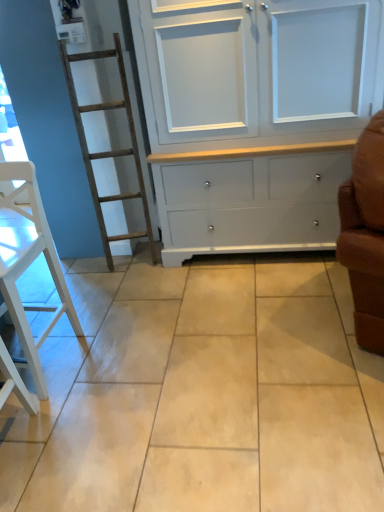
Describe the element at coordinates (201, 394) in the screenshot. I see `beige ceramic tile at center` at that location.

This screenshot has height=512, width=384. What do you see at coordinates (254, 116) in the screenshot?
I see `white painted wood cupboard at center` at bounding box center [254, 116].

Where is `beige ceramic tile at center`? Image resolution: width=384 pixels, height=512 pixels. beige ceramic tile at center is located at coordinates (201, 394).

Measure the distance from beige ceramic tile at center to white painted wood cupboard at center.

They are 31.58 inches apart.

Is beige ceramic tile at center outside of white painted wood cupboard at center?

Yes.

Is beige ceramic tile at center oriented away from white painted wood cupboard at center?

That's not correct — beige ceramic tile at center is not looking away from white painted wood cupboard at center.

Based on their sizes in the image, would you say beige ceramic tile at center is bigger or smaller than white painted wood cupboard at center?

beige ceramic tile at center is smaller than white painted wood cupboard at center.

From a real-world perspective, is beige ceramic tile at center beneath white wood chair at left?

Yes, from a real-world perspective, beige ceramic tile at center is beneath white wood chair at left.

Looking at their sizes, would you say beige ceramic tile at center is wider or thinner than white wood chair at left?

Considering their sizes, beige ceramic tile at center looks broader than white wood chair at left.

Is beige ceramic tile at center shorter than white wood chair at left?

Yes, beige ceramic tile at center is shorter than white wood chair at left.

Is point (255, 232) farther from camera compared to point (24, 501)?

Yes, it is.

Considering the relative positions of white painted wood cupboard at center and beige ceramic tile at center in the image provided, is white painted wood cupboard at center to the left of beige ceramic tile at center from the viewer's perspective?

No, white painted wood cupboard at center is not to the left of beige ceramic tile at center.

From the picture: Is white painted wood cupboard at center completely or partially outside of beige ceramic tile at center?

white painted wood cupboard at center lies outside beige ceramic tile at center's area.

Considering the sizes of objects white wood chair at left and white painted wood cupboard at center in the image provided, who is bigger, white wood chair at left or white painted wood cupboard at center?

white painted wood cupboard at center.

Which is in front, point (5, 292) or point (285, 55)?

The point (5, 292) is in front.

From their relative heights in the image, would you say white wood chair at left is taller or shorter than white painted wood cupboard at center?

white wood chair at left is shorter than white painted wood cupboard at center.

From a real-world perspective, between white wood chair at left and white painted wood cupboard at center, who is vertically lower?

white wood chair at left.

Which is in front, point (169, 117) or point (3, 281)?

The point (3, 281) is more forward.

From the image's perspective, is white painted wood cupboard at center located above or below white wood chair at left?

white painted wood cupboard at center is above white wood chair at left.

Between white painted wood cupboard at center and white wood chair at left, which one has more height?

Standing taller between the two is white painted wood cupboard at center.

Is white painted wood cupboard at center placed right next to white wood chair at left?

No, white painted wood cupboard at center is not with white wood chair at left.

Measure the distance between white wood chair at left and beige ceramic tile at center.

A distance of 57.87 centimeters exists between white wood chair at left and beige ceramic tile at center.

From a real-world perspective, is white wood chair at left physically located above or below beige ceramic tile at center?

In terms of real-world spatial position, white wood chair at left is above beige ceramic tile at center.

Does white wood chair at left touch beige ceramic tile at center?

No, white wood chair at left is not beside beige ceramic tile at center.

Considering the sizes of white wood chair at left and beige ceramic tile at center in the image, is white wood chair at left taller or shorter than beige ceramic tile at center?

In the image, white wood chair at left appears to be taller than beige ceramic tile at center.

Find the location of a particular element. The height and width of the screenshot is (512, 384). ceramic tile beneath the white painted wood cupboard at center (from a real-world perspective) is located at coordinates (201, 394).

The width and height of the screenshot is (384, 512). I want to click on ceramic tile that is below the white wood chair at left (from the image's perspective), so click(x=201, y=394).

Looking at the image, which one is located further to beige ceramic tile at center, white painted wood cupboard at center or white wood chair at left?

white painted wood cupboard at center is positioned further to the anchor beige ceramic tile at center.

Looking at this image, estimate the real-world distances between objects in this image. Which object is closer to beige ceramic tile at center, white wood chair at left or white painted wood cupboard at center?

Based on the image, white wood chair at left appears to be nearer to beige ceramic tile at center.

Based on their spatial positions, is white painted wood cupboard at center or beige ceramic tile at center further from white wood chair at left?

The object further to white wood chair at left is white painted wood cupboard at center.

Based on their spatial positions, is white wood chair at left or beige ceramic tile at center closer to white painted wood cupboard at center?

beige ceramic tile at center is positioned closer to the anchor white painted wood cupboard at center.

When comparing their distances from white wood chair at left, does beige ceramic tile at center or white painted wood cupboard at center seem further?

Based on the image, white painted wood cupboard at center appears to be further to white wood chair at left.

From the image, which object appears to be nearer to white painted wood cupboard at center, beige ceramic tile at center or white wood chair at left?

beige ceramic tile at center is positioned closer to the anchor white painted wood cupboard at center.

Identify the location of ceramic tile situated between white wood chair at left and white painted wood cupboard at center from left to right. This screenshot has width=384, height=512. (201, 394).